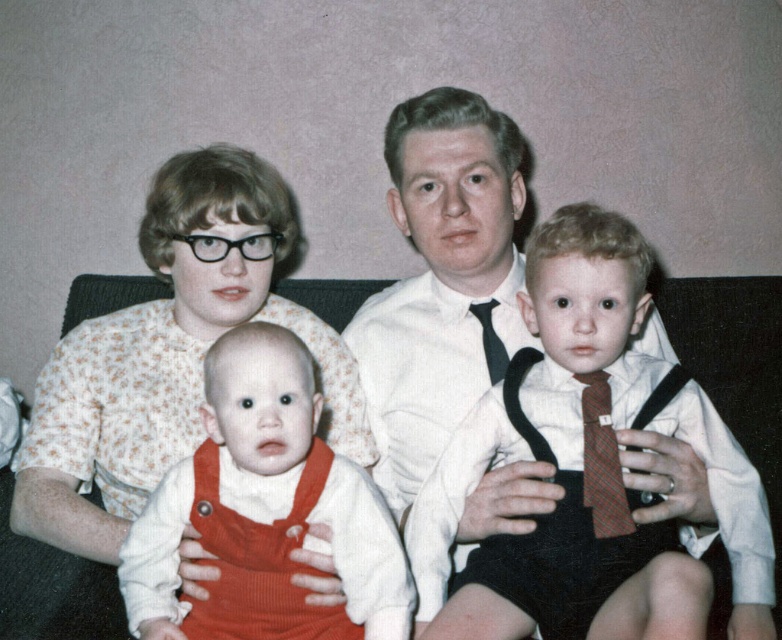
Question: Is floral fabric blouse at upper left wider than plaid fabric tie at right?

Choices:
 (A) yes
 (B) no

Answer: (A)

Question: Among these points, which one is nearest to the camera?

Choices:
 (A) (224, 292)
 (B) (370, 621)
 (C) (651, 362)
 (D) (603, 464)

Answer: (B)

Question: Where is matte corduroy overalls at center located in relation to black satin tie at center in the image?

Choices:
 (A) left
 (B) right

Answer: (A)

Question: Which object appears closest to the camera in this image?

Choices:
 (A) floral fabric blouse at upper left
 (B) plaid fabric tie at right

Answer: (A)

Question: Which of these objects is positioned farthest from the matte red suspenders at center?

Choices:
 (A) plaid fabric tie at right
 (B) matte corduroy overalls at center
 (C) black satin tie at center

Answer: (C)

Question: Can you confirm if plaid fabric tie at right is smaller than black satin tie at center?

Choices:
 (A) no
 (B) yes

Answer: (A)